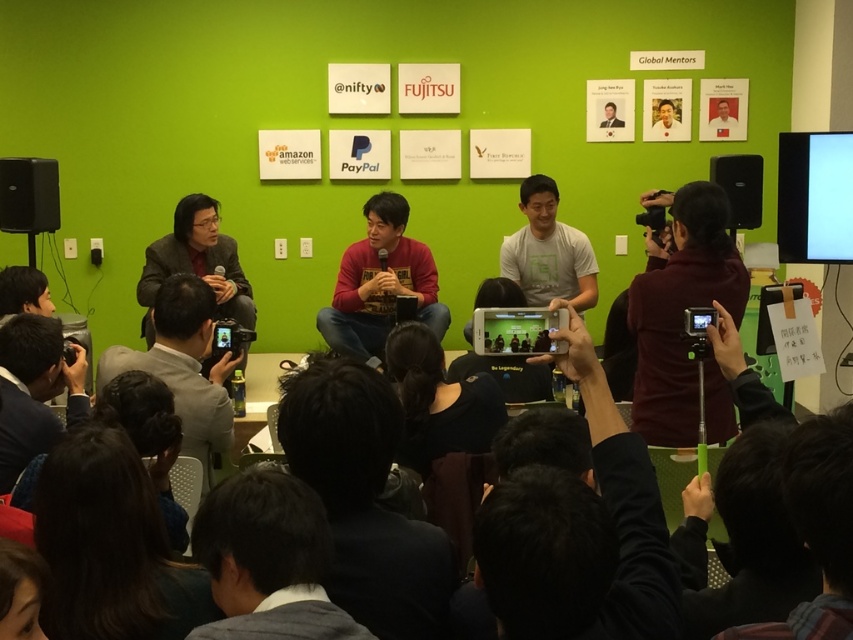
Looking at this image, between black matte speaker at left and black matte speaker at right, which one has more height?

black matte speaker at right is taller.

Consider the image. Is black matte speaker at left below black matte speaker at right?

Yes.

Is point (9, 164) more distant than point (728, 225)?

No, (9, 164) is closer to viewer.

The height and width of the screenshot is (640, 853). What are the coordinates of `black matte speaker at left` in the screenshot? It's located at (28, 195).

Is dark hair at lower center thinner than matte red sweater at center?

Yes, dark hair at lower center is thinner than matte red sweater at center.

Which is behind, point (706, 337) or point (376, 272)?

Positioned behind is point (376, 272).

Where is `dark hair at lower center`? dark hair at lower center is located at coordinates (589, 380).

Who is lower down, dark hair at lower center or black matte speaker at right?

dark hair at lower center is below.

Describe the element at coordinates (589, 380) in the screenshot. I see `dark hair at lower center` at that location.

At what (x,y) coordinates should I click in order to perform the action: click on dark hair at lower center. Please return your answer as a coordinate pair (x, y). This screenshot has height=640, width=853. Looking at the image, I should click on (589, 380).